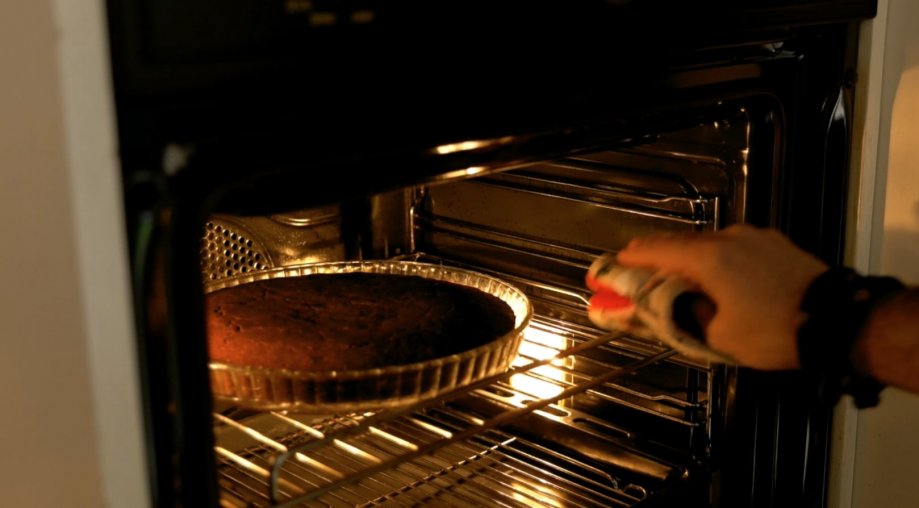
Find the location of a particular element. oven with hand stuck in is located at coordinates (311, 351), (762, 285), (817, 327), (617, 505), (414, 434).